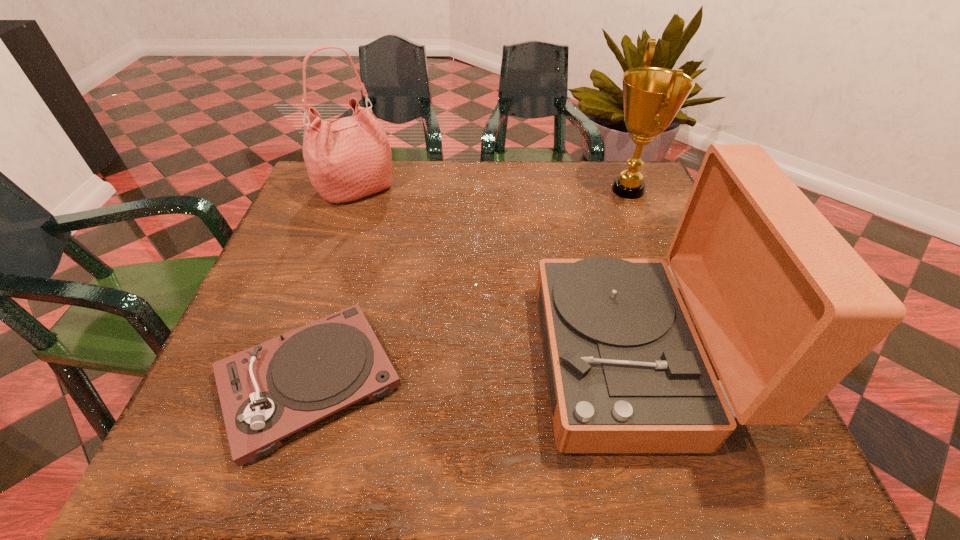
At what (x,y) coordinates should I click in order to perform the action: click on object located in the near left corner section of the desktop. Please return your answer as a coordinate pair (x, y). This screenshot has width=960, height=540. Looking at the image, I should click on (270, 391).

Locate an element on the screen. object at the far right corner is located at coordinates (652, 96).

Where is `object situated at the near right corner`? This screenshot has width=960, height=540. object situated at the near right corner is located at coordinates (786, 308).

The image size is (960, 540). I want to click on vacant space at the far edge, so click(417, 191).

Locate an element on the screen. vacant space at the near edge of the desktop is located at coordinates (373, 431).

Where is `vacant area at the right edge of the desktop`? vacant area at the right edge of the desktop is located at coordinates (657, 223).

Where is `free space at the far left corner of the desktop`? The height and width of the screenshot is (540, 960). free space at the far left corner of the desktop is located at coordinates (344, 203).

Identify the location of free point at the near right corner. (735, 462).

This screenshot has height=540, width=960. Identify the location of blank region between the handbag and the right phonograph_record. (494, 275).

At what (x,y) coordinates should I click in order to perform the action: click on blank region between the handbag and the award. Please return your answer as a coordinate pair (x, y). This screenshot has height=540, width=960. Looking at the image, I should click on pos(492,190).